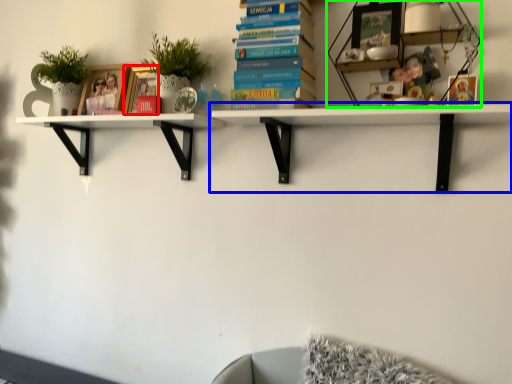
Question: Which object is the closest to the picture frame (highlighted by a red box)? Choose among these: shelf (highlighted by a blue box) or shelf (highlighted by a green box).

Choices:
 (A) shelf
 (B) shelf

Answer: (A)